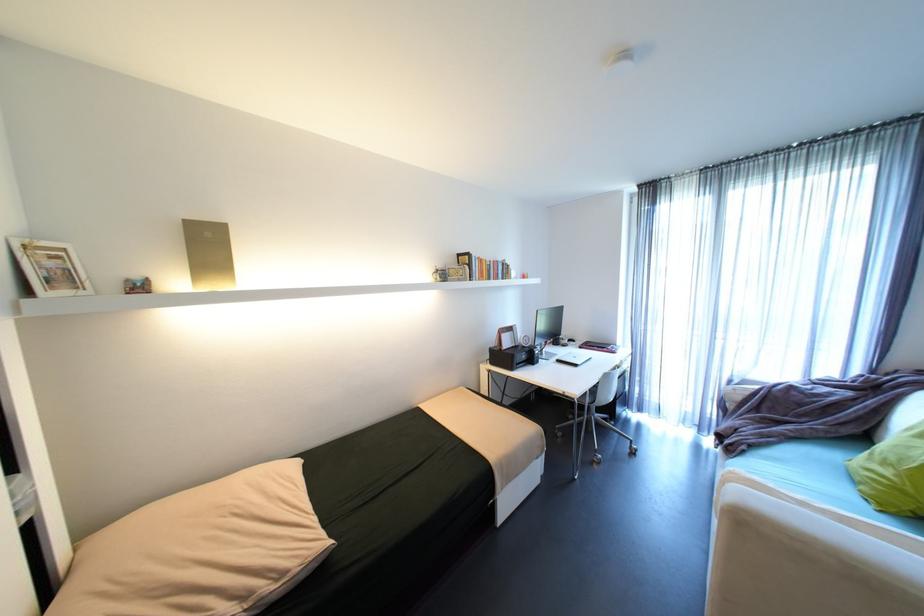
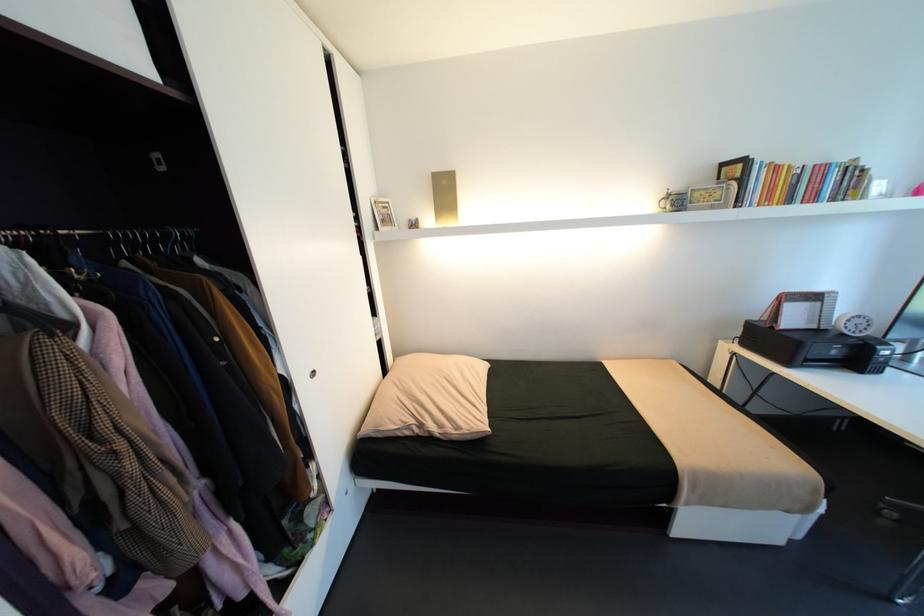
Question: The camera is either moving clockwise (left) or counter-clockwise (right) around the object. The first image is from the beginning of the video and the second image is from the end. Is the camera moving left or right when shooting the video?

Choices:
 (A) Left
 (B) Right

Answer: (B)